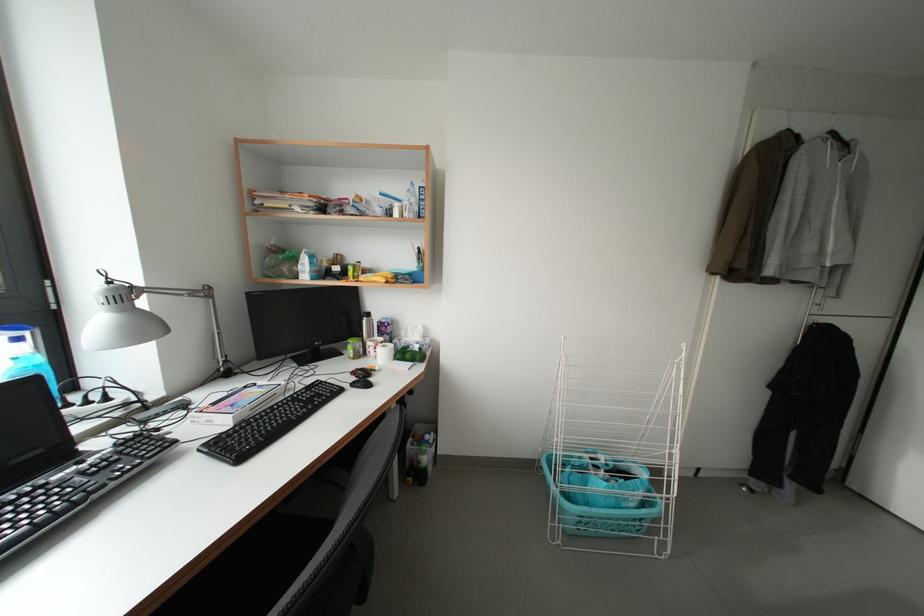
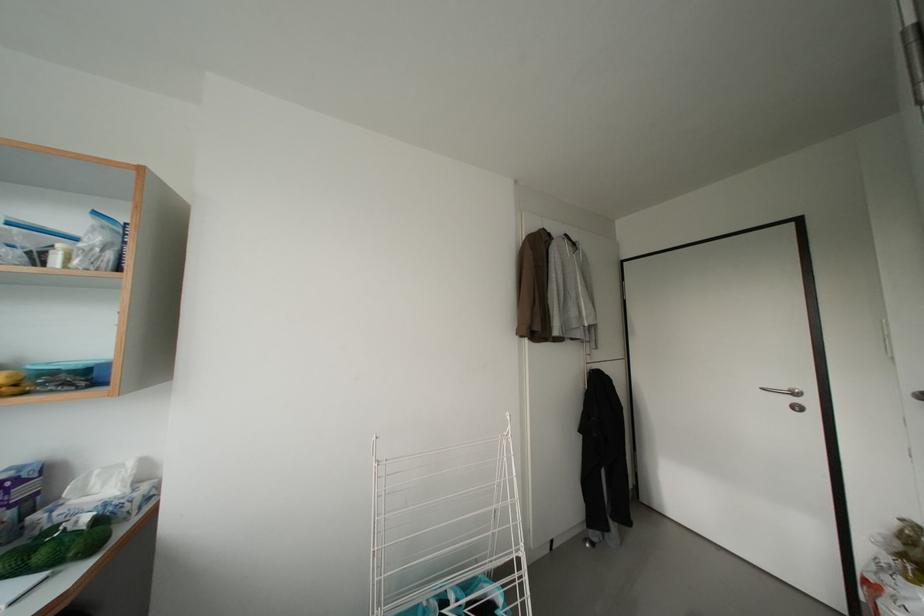
In the second image, find the point that corresponds to (x=391, y=326) in the first image.

(11, 482)